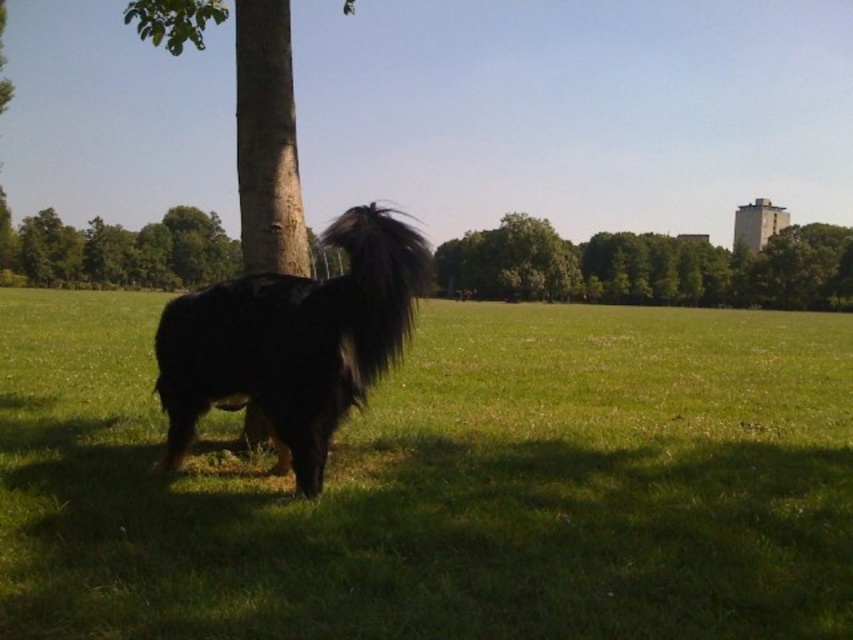
Question: Can you confirm if black fluffy dog at center is positioned to the right of green leafy tree at upper left?

Choices:
 (A) yes
 (B) no

Answer: (A)

Question: Which object is closer to the camera taking this photo?

Choices:
 (A) black fluffy dog at center
 (B) green leafy tree at upper left
 (C) green leafy tree at upper center
 (D) black fur dog at center

Answer: (D)

Question: Does black fluffy dog at center come behind green leafy tree at upper center?

Choices:
 (A) yes
 (B) no

Answer: (B)

Question: Does black fur dog at center lie in front of green leafy tree at upper center?

Choices:
 (A) no
 (B) yes

Answer: (B)

Question: Which object is closer to the camera taking this photo?

Choices:
 (A) black fur dog at center
 (B) green leafy tree at upper left
 (C) green leafy tree at upper center

Answer: (A)

Question: Which point is farther from the camera taking this photo?

Choices:
 (A) (56, 259)
 (B) (300, 432)

Answer: (A)